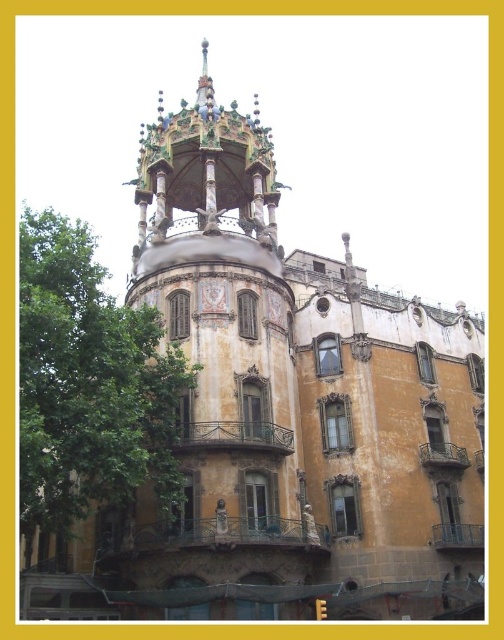
You are standing in front of the yellowish textured building at center and want to take a photo of it. However, there is a green leafy tree at left in the way. Can you see the building clearly without the tree blocking it?

The green leafy tree at left is behind the yellowish textured building at center, so you can see the building clearly without the tree blocking it.

You are standing in front of the yellowish textured building at center. You want to walk to the nearest entrance. The nearest entrance is located 45.07 meters away from your current position. If you walk at a speed of 1.5 meters per second, how many seconds will it take you to reach the entrance?

The nearest entrance is 45.07 meters away. At a speed of 1.5 meters per second, it will take 45.07 divided by 1.5, which equals approximately 30.05 seconds to reach the entrance.